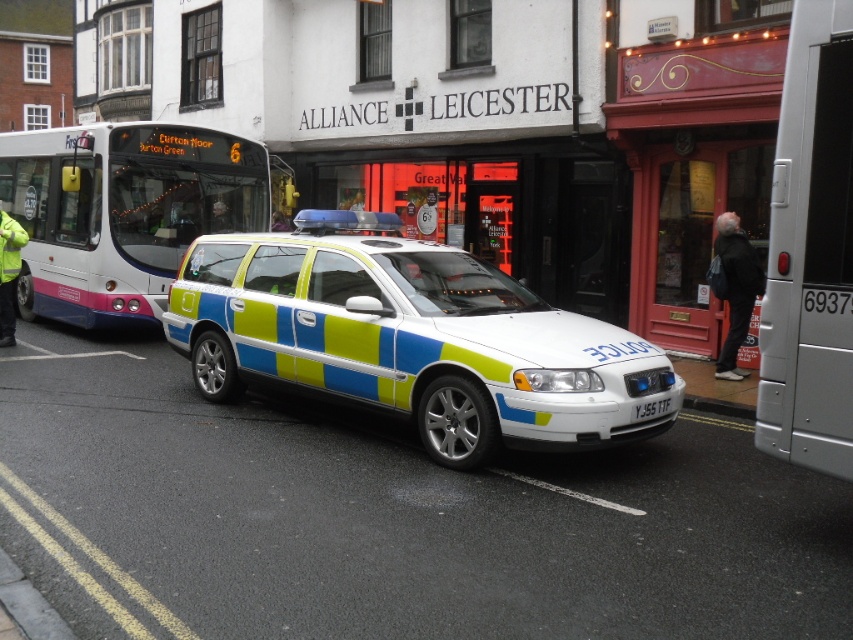
Is point (799, 180) positioned after point (16, 221)?

No, (799, 180) is in front of (16, 221).

From the picture: Who is more distant from viewer, [816,461] or [6,230]?

Positioned behind is point [6,230].

At what (x,y) coordinates should I click in order to perform the action: click on metallic silver van at right. Please return your answer as a coordinate pair (x, y). The width and height of the screenshot is (853, 640). Looking at the image, I should click on point(810,252).

Between white plastic bus at center and yellow-green striped police car at left, which one appears on the right side from the viewer's perspective?

white plastic bus at center is more to the right.

Can you confirm if white plastic bus at center is positioned to the left of yellow-green striped police car at left?

No, white plastic bus at center is not to the left of yellow-green striped police car at left.

Is point (136, 236) closer to camera compared to point (4, 328)?

No, it is not.

Locate an element on the screen. white plastic bus at center is located at coordinates (122, 212).

Between white glossy police car at center and white plastic bus at center, which one is positioned lower?

white glossy police car at center is below.

Who is taller, white glossy police car at center or white plastic bus at center?

white plastic bus at center is taller.

This screenshot has height=640, width=853. Describe the element at coordinates (409, 337) in the screenshot. I see `white glossy police car at center` at that location.

Find the location of a particular element. white glossy police car at center is located at coordinates (409, 337).